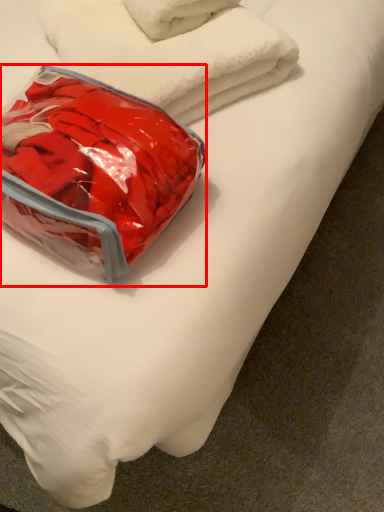
Question: From the image's perspective, considering the relative positions of pack (annotated by the red box) and towel in the image provided, where is pack (annotated by the red box) located with respect to the staircase?

Choices:
 (A) below
 (B) above

Answer: (A)